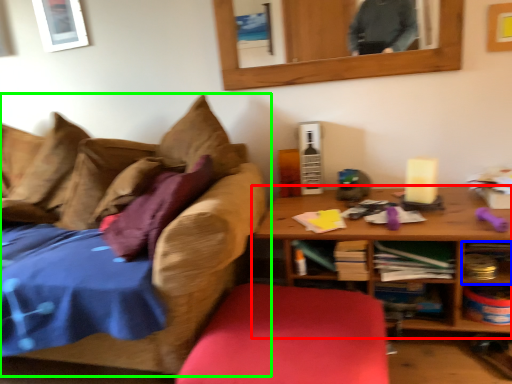
Question: Which object is positioned closest to table (highlighted by a red box)? Select from shelf (highlighted by a blue box) and studio couch (highlighted by a green box).

Choices:
 (A) shelf
 (B) studio couch

Answer: (A)